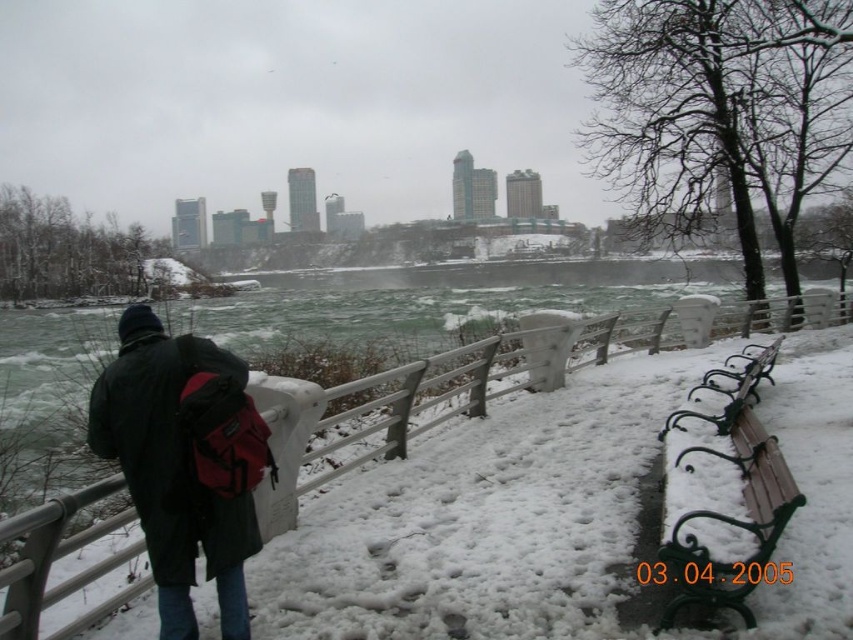
Question: Is matte black jacket at left further to the viewer compared to wooden bench at right?

Choices:
 (A) no
 (B) yes

Answer: (A)

Question: Which object is farther from the camera taking this photo?

Choices:
 (A) wooden bench at right
 (B) matte black jacket at left

Answer: (A)

Question: Does matte black jacket at left appear on the left side of wooden bench at right?

Choices:
 (A) yes
 (B) no

Answer: (A)

Question: Which of the following is the closest to the observer?

Choices:
 (A) matte black jacket at left
 (B) wooden bench at right

Answer: (A)

Question: Which of the following is the farthest from the observer?

Choices:
 (A) matte black jacket at left
 (B) wooden bench at right

Answer: (B)

Question: Does matte black jacket at left appear on the left side of wooden bench at right?

Choices:
 (A) yes
 (B) no

Answer: (A)